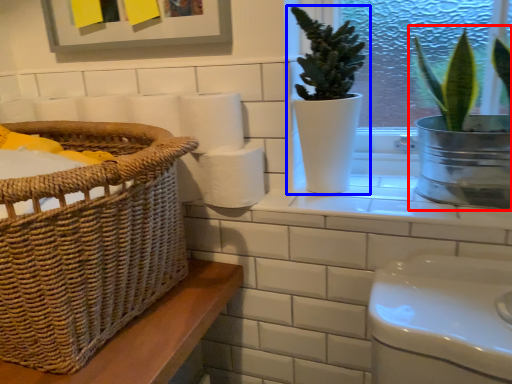
Question: Which of the following is the closest to the observer, houseplant (highlighted by a red box) or houseplant (highlighted by a blue box)?

Choices:
 (A) houseplant
 (B) houseplant

Answer: (A)